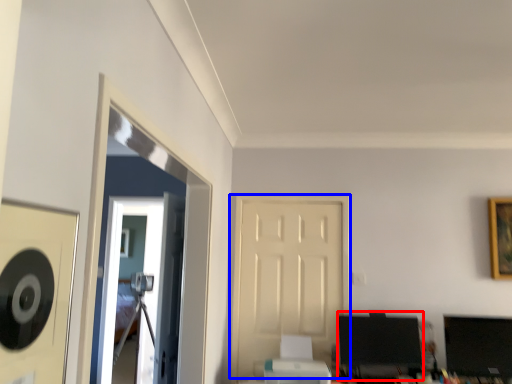
Question: Which object appears closest to the camera in this image, computer monitor (highlighted by a red box) or door (highlighted by a blue box)?

Choices:
 (A) computer monitor
 (B) door

Answer: (A)